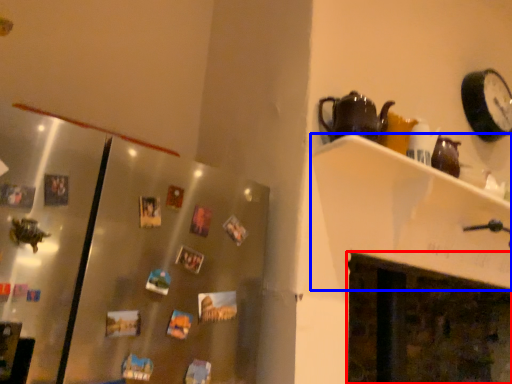
Question: Which of the following is the farthest to the observer, fireplace (highlighted by a red box) or shelf (highlighted by a blue box)?

Choices:
 (A) fireplace
 (B) shelf

Answer: (A)